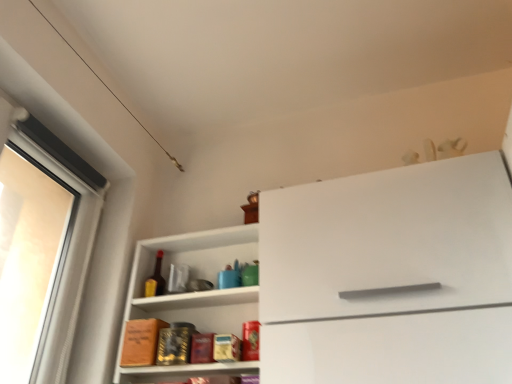
Question: Should I look upward or downward to see white matte cabinet at center?

Choices:
 (A) up
 (B) down

Answer: (B)

Question: Does white glossy shelf at center touch white matte cabinet at center?

Choices:
 (A) no
 (B) yes

Answer: (A)

Question: From a real-world perspective, does white glossy shelf at center stand above white matte cabinet at center?

Choices:
 (A) no
 (B) yes

Answer: (B)

Question: Is white glossy shelf at center in front of white matte cabinet at center?

Choices:
 (A) yes
 (B) no

Answer: (B)

Question: Is white glossy shelf at center taller than white matte cabinet at center?

Choices:
 (A) yes
 (B) no

Answer: (B)

Question: Is white glossy shelf at center to the left of white matte cabinet at center from the viewer's perspective?

Choices:
 (A) yes
 (B) no

Answer: (A)

Question: Does white glossy shelf at center have a larger size compared to white matte cabinet at center?

Choices:
 (A) yes
 (B) no

Answer: (B)

Question: From a real-world perspective, is matte glass bottle at center under white matte cabinet at center?

Choices:
 (A) yes
 (B) no

Answer: (B)

Question: Is matte glass bottle at center bigger than white matte cabinet at center?

Choices:
 (A) yes
 (B) no

Answer: (B)

Question: Are matte glass bottle at center and white matte cabinet at center far apart?

Choices:
 (A) yes
 (B) no

Answer: (B)

Question: Can you confirm if matte glass bottle at center is wider than white matte cabinet at center?

Choices:
 (A) yes
 (B) no

Answer: (B)

Question: From the image's perspective, would you say matte glass bottle at center is shown under white matte cabinet at center?

Choices:
 (A) yes
 (B) no

Answer: (A)

Question: Does matte glass bottle at center have a smaller size compared to white matte cabinet at center?

Choices:
 (A) no
 (B) yes

Answer: (B)

Question: Are white matte cabinet at center and white glossy shelf at center making contact?

Choices:
 (A) no
 (B) yes

Answer: (A)